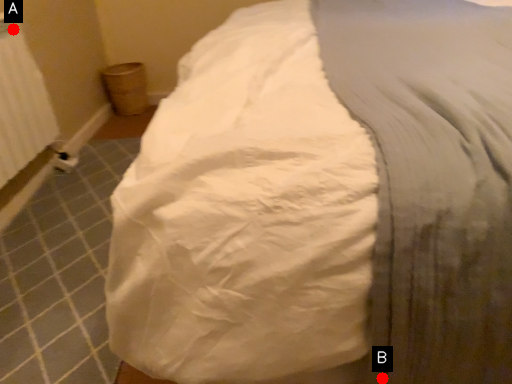
Question: Two points are circled on the image, labeled by A and B beside each circle. Which of the following is the closest to the observer?

Choices:
 (A) A is closer
 (B) B is closer

Answer: (B)